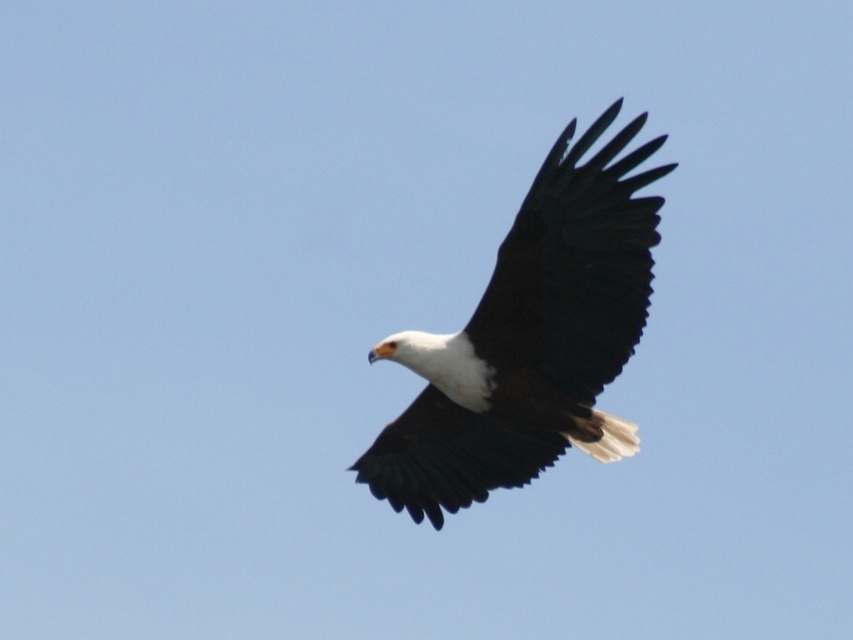
Measure the distance from white matte eagle at center to black matte wing at center.

white matte eagle at center is 3.49 meters away from black matte wing at center.

Can you confirm if white matte eagle at center is thinner than black matte wing at center?

No.

Who is more distant from viewer, (543, 458) or (605, 124)?

Point (543, 458)

The image size is (853, 640). Identify the location of white matte eagle at center. (531, 339).